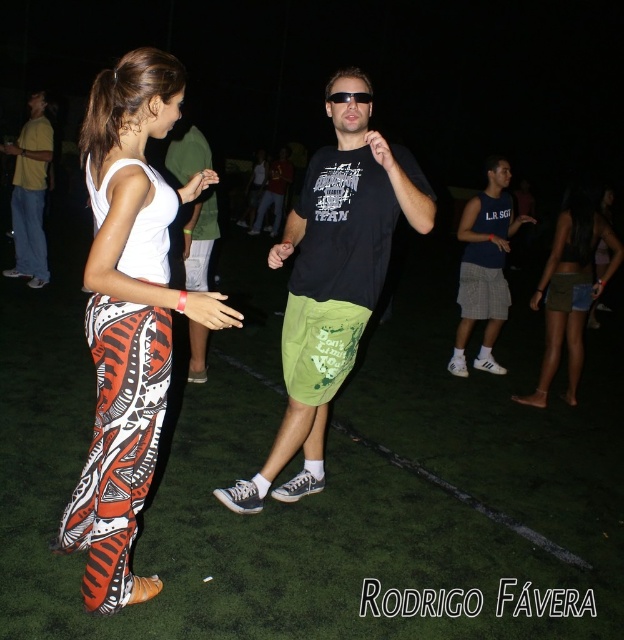
Does green artificial turf at center appear under green fabric shorts at center?

Yes.

Does green artificial turf at center appear on the left side of green fabric shorts at center?

In fact, green artificial turf at center is to the right of green fabric shorts at center.

Locate an element on the screen. The width and height of the screenshot is (624, 640). green artificial turf at center is located at coordinates (324, 486).

This screenshot has height=640, width=624. Identify the location of green artificial turf at center. click(x=324, y=486).

Is black matte t-shirt at center wider than yellow cotton shirt at left?

Correct, the width of black matte t-shirt at center exceeds that of yellow cotton shirt at left.

Does black matte t-shirt at center have a smaller size compared to yellow cotton shirt at left?

No, black matte t-shirt at center is not smaller than yellow cotton shirt at left.

This screenshot has width=624, height=640. I want to click on black matte t-shirt at center, so click(x=333, y=285).

Does printed leggings at left have a greater height compared to green fabric shorts at center?

Correct, printed leggings at left is much taller as green fabric shorts at center.

Is point (107, 212) behind point (197, 129)?

No.

Identify the location of printed leggings at left. The image size is (624, 640). (129, 316).

The height and width of the screenshot is (640, 624). Find the location of `printed leggings at left`. printed leggings at left is located at coordinates (129, 316).